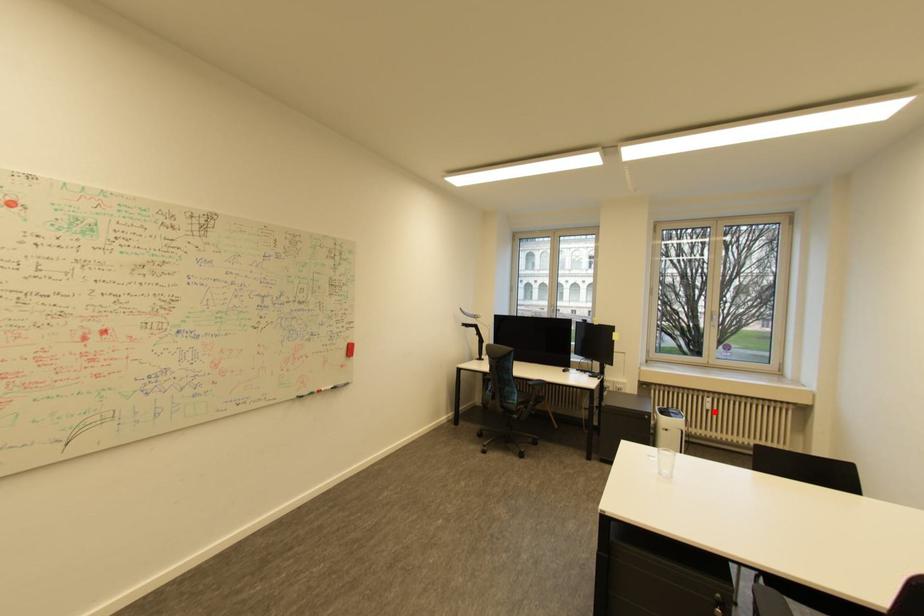
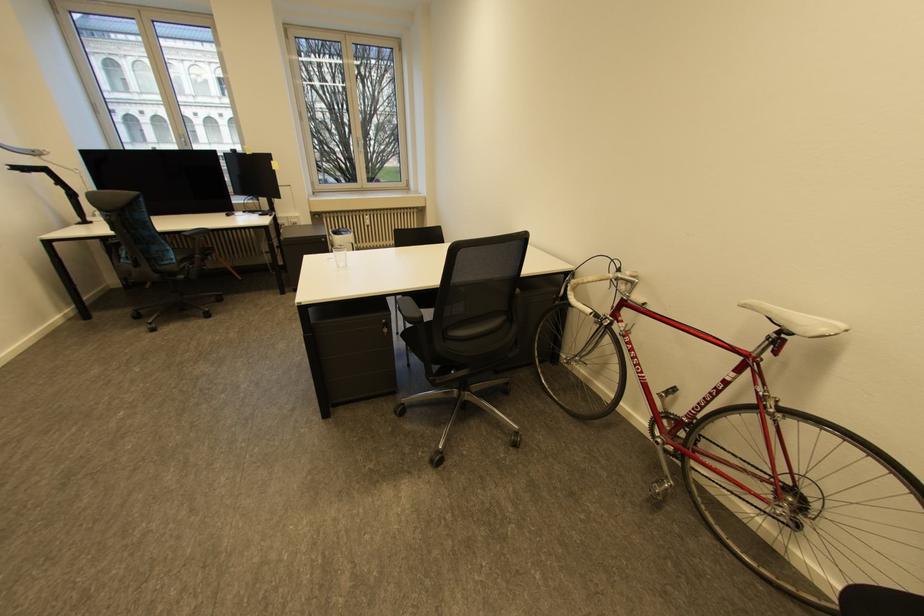
Question: I am providing you with two images of the same scene from different viewpoints. Given a red point in image1, look at the same physical point in image2. Is it:

Choices:
 (A) Closer to the viewpoint
 (B) Farther from the viewpoint

Answer: (B)